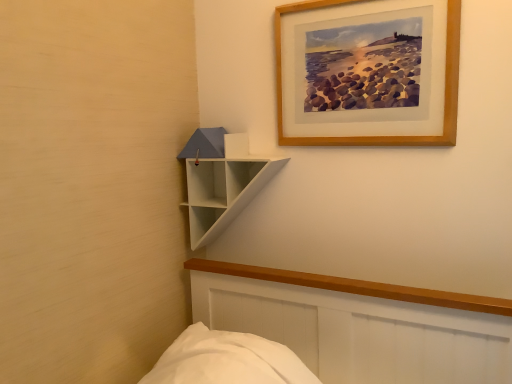
Question: Is white matte shelf at upper left positioned beyond the bounds of wooden picture frame at upper right?

Choices:
 (A) yes
 (B) no

Answer: (A)

Question: Can you confirm if white matte shelf at upper left is wider than wooden picture frame at upper right?

Choices:
 (A) yes
 (B) no

Answer: (A)

Question: Is white matte shelf at upper left closer to camera compared to wooden picture frame at upper right?

Choices:
 (A) yes
 (B) no

Answer: (B)

Question: Could you tell me if white matte shelf at upper left is facing wooden picture frame at upper right?

Choices:
 (A) yes
 (B) no

Answer: (B)

Question: Is white matte shelf at upper left smaller than wooden picture frame at upper right?

Choices:
 (A) yes
 (B) no

Answer: (B)

Question: From the image's perspective, is white matte shelf at upper left located above wooden picture frame at upper right?

Choices:
 (A) yes
 (B) no

Answer: (B)

Question: Is wooden picture frame at upper right shorter than white matte shelf at upper left?

Choices:
 (A) no
 (B) yes

Answer: (A)

Question: Is wooden picture frame at upper right not within white matte shelf at upper left?

Choices:
 (A) yes
 (B) no

Answer: (A)

Question: Considering the relative positions of wooden picture frame at upper right and white matte shelf at upper left in the image provided, is wooden picture frame at upper right to the right of white matte shelf at upper left from the viewer's perspective?

Choices:
 (A) yes
 (B) no

Answer: (A)

Question: Are wooden picture frame at upper right and white matte shelf at upper left making contact?

Choices:
 (A) no
 (B) yes

Answer: (A)

Question: Is the position of wooden picture frame at upper right more distant than that of white matte shelf at upper left?

Choices:
 (A) no
 (B) yes

Answer: (A)

Question: Does wooden picture frame at upper right have a lesser width compared to white matte shelf at upper left?

Choices:
 (A) no
 (B) yes

Answer: (B)

Question: Would you say wooden picture frame at upper right is to the left or to the right of white matte shelf at upper left in the picture?

Choices:
 (A) right
 (B) left

Answer: (A)